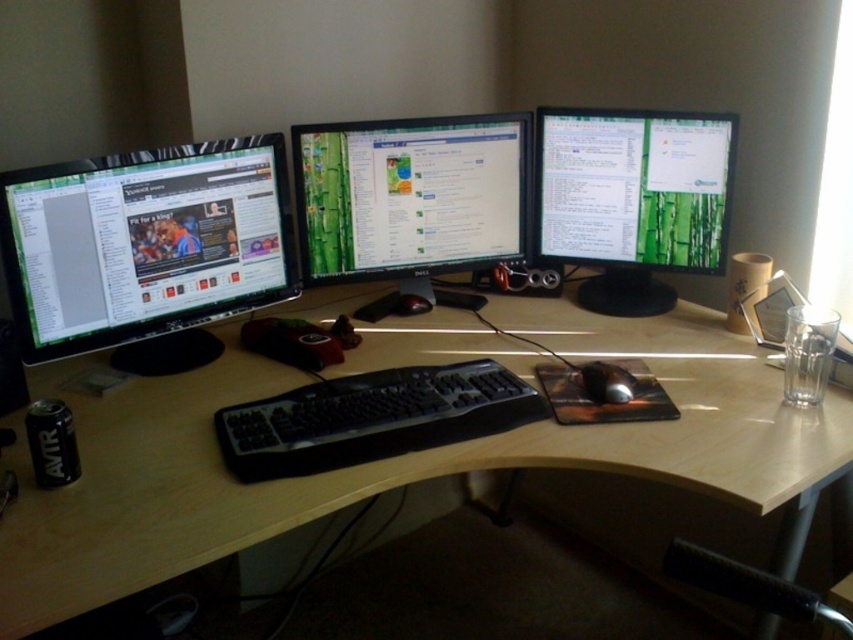
Question: Among these points, which one is nearest to the camera?

Choices:
 (A) (260, 448)
 (B) (469, 154)
 (C) (207, 376)
 (D) (693, 269)

Answer: (A)

Question: Can you confirm if matte black monitor at left is positioned to the right of black rubber mouse at center?

Choices:
 (A) no
 (B) yes

Answer: (A)

Question: Which point is farther from the camera taking this photo?

Choices:
 (A) (613, 109)
 (B) (549, 428)
 (C) (467, 188)
 (D) (350, 433)

Answer: (C)

Question: Is light wood computer desk at center to the right of matte black monitor at center right from the viewer's perspective?

Choices:
 (A) no
 (B) yes

Answer: (A)

Question: In this image, where is light wood computer desk at center located relative to matte black monitor at center right?

Choices:
 (A) left
 (B) right

Answer: (A)

Question: Estimate the real-world distances between objects in this image. Which object is farther from the black plastic keyboard at center?

Choices:
 (A) matte black monitor at left
 (B) light wood computer desk at center

Answer: (A)